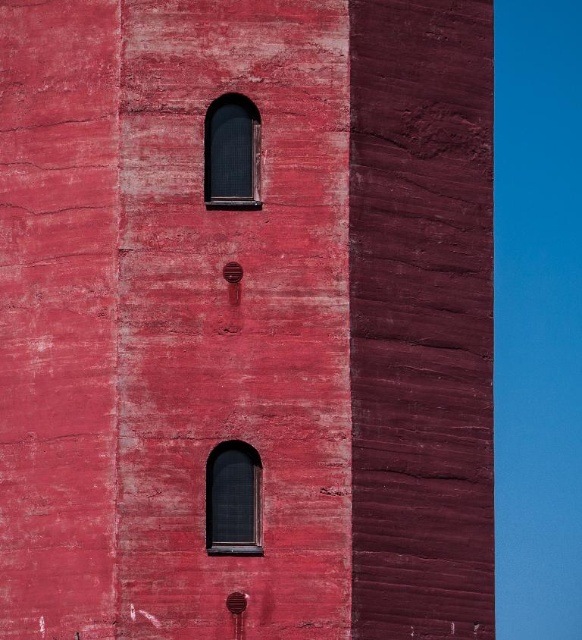
You are standing in front of the tall red structure and notice the matte black window at upper center. Can you determine its exact position coordinates?

The matte black window at upper center is located at point coordinates (232, 154).

You are a window cleaner standing on a ladder at the base of the tower. You need to clean both the matte black window at upper center and the matte black window at lower center. If your ladder can reach up to 6 meters, will you be able to clean both windows without moving the ladder?

The distance between the matte black window at upper center and the matte black window at lower center is 6.65 meters. Since the ladder can only reach up to 6 meters, you will not be able to clean both windows without moving the ladder because the total distance exceeds the ladder capacity.